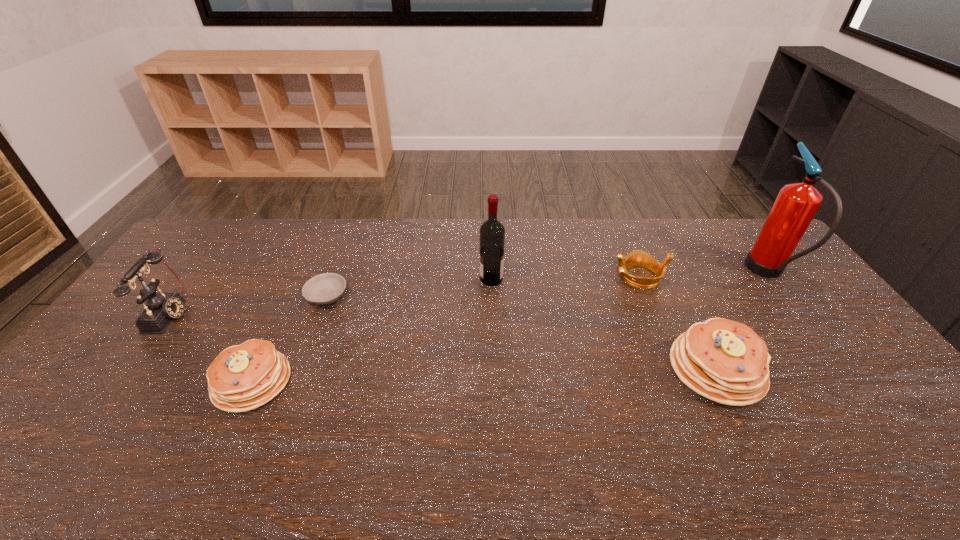
Please point a spot to place another pancake for symmetrical spacing. Please provide its 2D coordinates. Your answer should be formatted as a tuple, i.e. [(x, y)], where the tuple contains the x and y coordinates of a point satisfying the conditions above.

[(488, 375)]